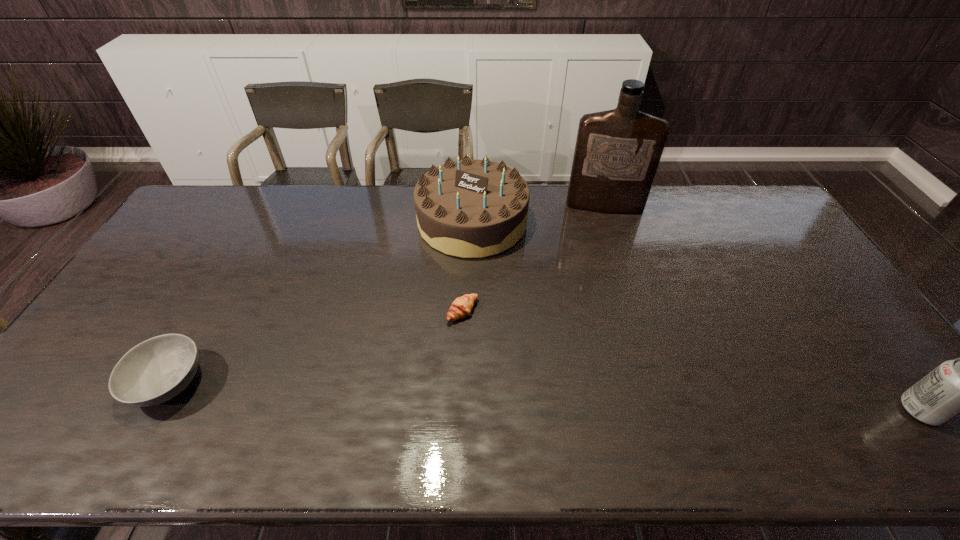
The image size is (960, 540). What are the coordinates of `the leftmost object` in the screenshot? It's located at (155, 371).

This screenshot has height=540, width=960. Find the location of `bowl`. bowl is located at coordinates (155, 371).

Locate an element on the screen. The height and width of the screenshot is (540, 960). the third tallest object is located at coordinates (959, 386).

Identify the location of the rightmost object. The image size is (960, 540). (959, 386).

I want to click on the second object from right to left, so click(617, 152).

The width and height of the screenshot is (960, 540). Find the location of `liquor`. liquor is located at coordinates (617, 152).

Where is `pastry`? pastry is located at coordinates (461, 307).

In order to click on the third farthest object in this screenshot , I will do `click(461, 307)`.

Where is `birthday cake`? This screenshot has height=540, width=960. birthday cake is located at coordinates [x=469, y=208].

Locate an element on the screen. vacant space situated on the back of the bowl is located at coordinates (202, 323).